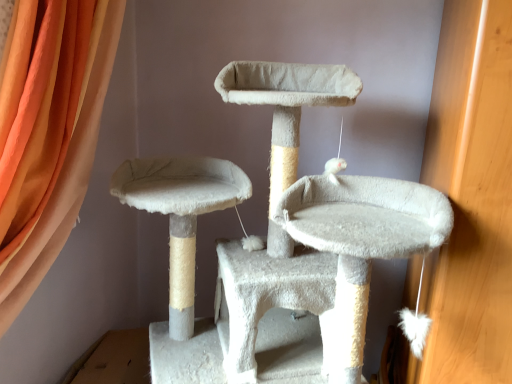
Question: Considering their positions, is white fluffy cat furniture at center located in front of or behind orange fabric curtain at upper left?

Choices:
 (A) behind
 (B) front

Answer: (B)

Question: Considering the positions of white fluffy cat furniture at center and orange fabric curtain at upper left in the image, is white fluffy cat furniture at center wider or thinner than orange fabric curtain at upper left?

Choices:
 (A) wide
 (B) thin

Answer: (A)

Question: From a real-world perspective, is white fluffy cat furniture at center positioned above or below orange fabric curtain at upper left?

Choices:
 (A) above
 (B) below

Answer: (B)

Question: Is orange fabric curtain at upper left to the left or to the right of white fluffy cat furniture at center in the image?

Choices:
 (A) left
 (B) right

Answer: (A)

Question: In the image, is orange fabric curtain at upper left positioned in front of or behind white fluffy cat furniture at center?

Choices:
 (A) behind
 (B) front

Answer: (A)

Question: Considering the positions of point (46, 220) and point (204, 208), is point (46, 220) closer or farther from the camera than point (204, 208)?

Choices:
 (A) farther
 (B) closer

Answer: (B)

Question: From the image's perspective, is orange fabric curtain at upper left positioned above or below white fluffy cat furniture at center?

Choices:
 (A) above
 (B) below

Answer: (A)